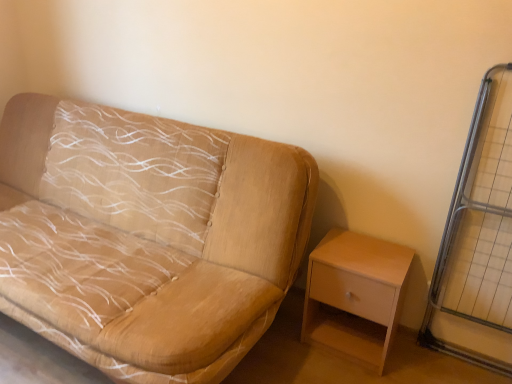
Question: From the image's perspective, would you say beige fabric couch at left is positioned over metal grid at right?

Choices:
 (A) yes
 (B) no

Answer: (A)

Question: Considering the relative sizes of beige fabric couch at left and metal grid at right in the image provided, is beige fabric couch at left taller than metal grid at right?

Choices:
 (A) no
 (B) yes

Answer: (A)

Question: Can you confirm if beige fabric couch at left is smaller than metal grid at right?

Choices:
 (A) no
 (B) yes

Answer: (A)

Question: Can you confirm if beige fabric couch at left is positioned to the right of metal grid at right?

Choices:
 (A) no
 (B) yes

Answer: (A)

Question: Is beige fabric couch at left at the left side of metal grid at right?

Choices:
 (A) no
 (B) yes

Answer: (B)

Question: Can we say beige fabric couch at left lies outside metal grid at right?

Choices:
 (A) no
 (B) yes

Answer: (B)

Question: Is beige fabric couch at left to the left of light wood/wooden nightstand at lower right from the viewer's perspective?

Choices:
 (A) no
 (B) yes

Answer: (B)

Question: Is beige fabric couch at left smaller than light wood/wooden nightstand at lower right?

Choices:
 (A) no
 (B) yes

Answer: (A)

Question: Is beige fabric couch at left turned away from light wood/wooden nightstand at lower right?

Choices:
 (A) yes
 (B) no

Answer: (B)

Question: Can you confirm if beige fabric couch at left is bigger than light wood/wooden nightstand at lower right?

Choices:
 (A) no
 (B) yes

Answer: (B)

Question: From the image's perspective, is beige fabric couch at left located beneath light wood/wooden nightstand at lower right?

Choices:
 (A) no
 (B) yes

Answer: (A)

Question: Can you confirm if beige fabric couch at left is positioned to the right of light wood/wooden nightstand at lower right?

Choices:
 (A) no
 (B) yes

Answer: (A)

Question: Is metal grid at right far away from light wood/wooden nightstand at lower right?

Choices:
 (A) no
 (B) yes

Answer: (A)